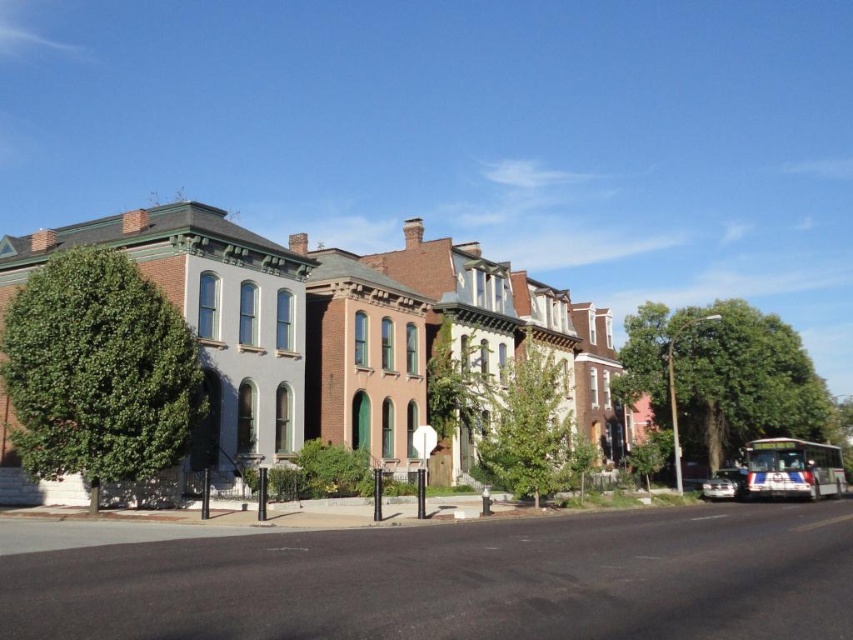
You are a city planner assessing the street layout. You need to install a new streetlight between the green leafy tree at left and the green leafy tree at center. Considering their heights, which tree would require a taller pole to avoid blocking sunlight?

The green leafy tree at left has a greater height compared to the green leafy tree at center, so installing a taller pole near the green leafy tree at left would be necessary to ensure sunlight isn

You are standing on the sidewalk in front of the historic buildings and notice two green leafy trees. Which tree, the green leafy tree at right or the green leafy tree at center, is closer to you?

The green leafy tree at right is closer to you because the green leafy tree at center is behind it.

You are standing at the intersection and want to walk to the green leafy tree at right. Which direction should you head towards?

The green leafy tree at right is located at coordinates point (723, 376), so you should head towards the right side of the street to reach it.